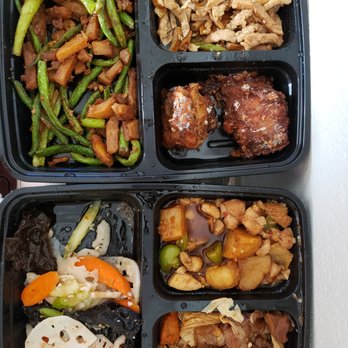
Locate an element on the screen. wall is located at coordinates (332, 172).